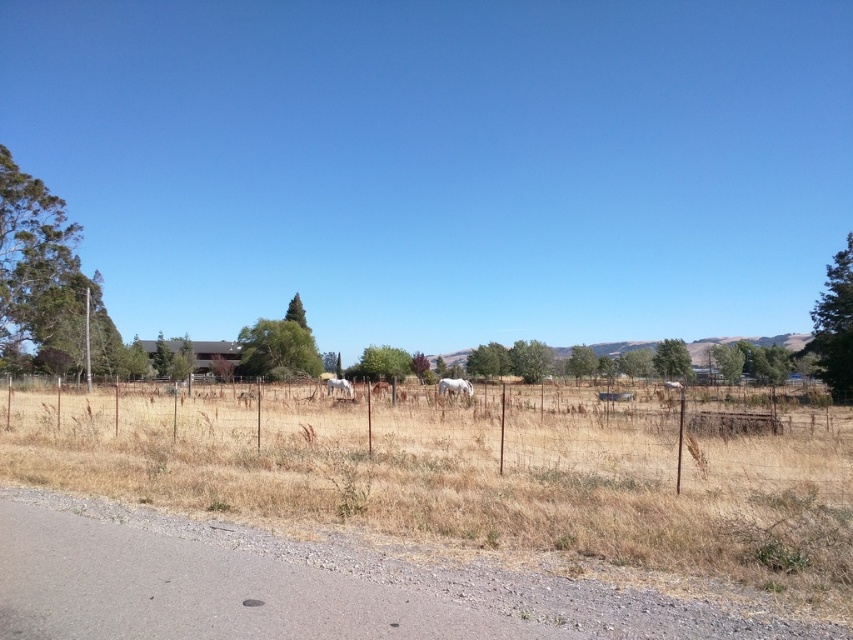
Looking at this image, who is taller, dry grass at center or white glossy horse at center?

white glossy horse at center

Is dry grass at center above white glossy horse at center?

Yes, dry grass at center is above white glossy horse at center.

Which is behind, point (816, 468) or point (445, 387)?

The point (445, 387) is behind.

The width and height of the screenshot is (853, 640). Identify the location of dry grass at center. (469, 476).

Between point (451, 534) and point (341, 385), which one is positioned in front?

Point (451, 534)

Who is positioned more to the left, dry grass at center or white matte horse at center?

white matte horse at center

Where is `dry grass at center`? The width and height of the screenshot is (853, 640). dry grass at center is located at coordinates (469, 476).

Is point (444, 384) in front of point (335, 384)?

Yes, point (444, 384) is in front of point (335, 384).

Is white glossy horse at center shorter than white matte horse at center?

In fact, white glossy horse at center may be taller than white matte horse at center.

Which is in front, point (448, 392) or point (328, 380)?

Point (448, 392) is more forward.

Image resolution: width=853 pixels, height=640 pixels. I want to click on white glossy horse at center, so click(454, 387).